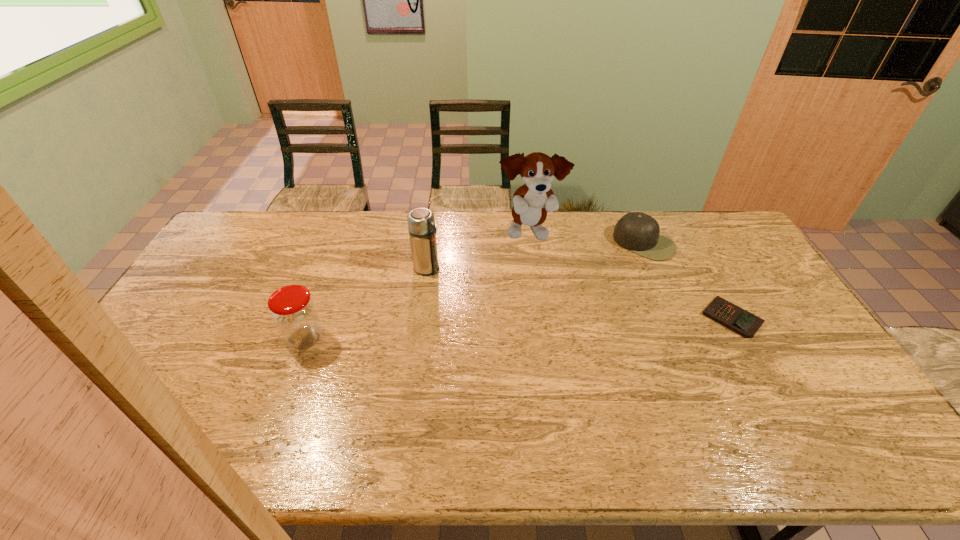
This screenshot has width=960, height=540. What are the coordinates of `free spot on the desktop that is between the third shortest object and the calculator and is positioned on the brim of the fourth tallest object` in the screenshot? It's located at (580, 325).

The height and width of the screenshot is (540, 960). I want to click on free space on the desktop that is between the leftmost object and the shortest object and is positioned with a handle on the side of the fourth object from right to left, so click(x=512, y=328).

The image size is (960, 540). Identify the location of free space on the desktop that is between the third tallest object and the calculator and is positioned on the face of the third object from right to left. (586, 325).